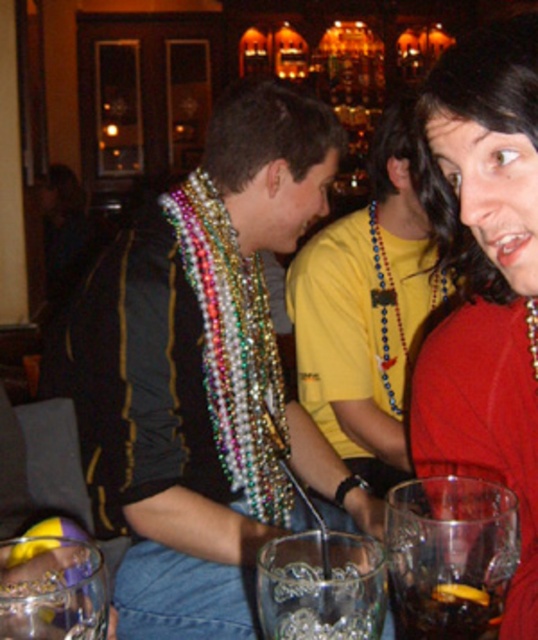
Does multicolored beaded necklace at center lie in front of clear glass at center?

No, multicolored beaded necklace at center is behind clear glass at center.

Is multicolored beaded necklace at center to the right of clear glass at center from the viewer's perspective?

Correct, you'll find multicolored beaded necklace at center to the right of clear glass at center.

Is point (369, 339) closer to camera compared to point (280, 580)?

No, it is not.

Find the location of a particular element. multicolored beaded necklace at center is located at coordinates (366, 312).

Find the location of a particular element. matte red dress at center is located at coordinates (484, 280).

Based on the photo, is matte red dress at center further to the viewer compared to clear glass wine glass at lower left?

Yes.

Locate an element on the screen. matte red dress at center is located at coordinates (484, 280).

You are a GUI agent. You are given a task and a screenshot of the screen. Output one action in this format:
    pyautogui.click(x=<x>, y=<y>)
    Task: Click on the matte red dress at center
    
    Given the screenshot: What is the action you would take?
    click(x=484, y=280)

Does multicolored beaded necklace at center have a lesser width compared to clear glass wine glass at lower left?

Incorrect, multicolored beaded necklace at center's width is not less than clear glass wine glass at lower left's.

Is point (372, 278) less distant than point (60, 563)?

No, (372, 278) is further to viewer.

Image resolution: width=538 pixels, height=640 pixels. Find the location of `multicolored beaded necklace at center`. multicolored beaded necklace at center is located at coordinates (366, 312).

The height and width of the screenshot is (640, 538). Find the location of `multicolored beaded necklace at center`. multicolored beaded necklace at center is located at coordinates (366, 312).